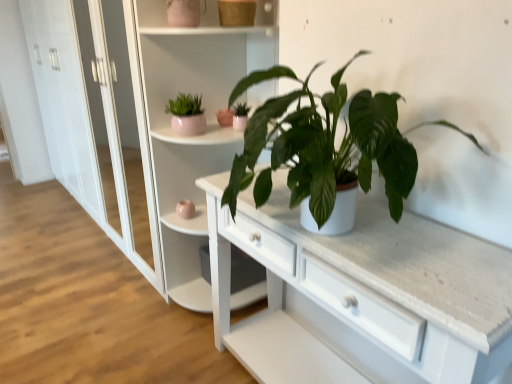
The height and width of the screenshot is (384, 512). In order to click on vacant point to the left of white glossy bookshelf at upper center in this screenshot , I will do `click(132, 319)`.